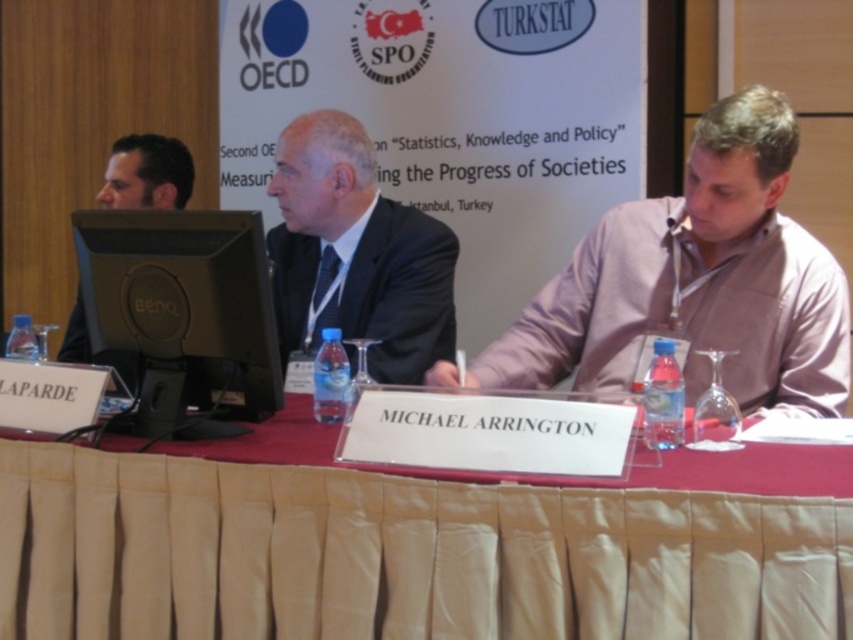
Question: Can you confirm if black glossy monitor at center is smaller than black suit at center?

Choices:
 (A) no
 (B) yes

Answer: (B)

Question: Does beige fabric tablecloth at center have a larger size compared to black suit at center?

Choices:
 (A) no
 (B) yes

Answer: (B)

Question: Among these points, which one is farthest from the camera?

Choices:
 (A) coord(839,376)
 (B) coord(216,248)
 (C) coord(97,195)

Answer: (C)

Question: Which object is positioned farthest from the black suit at center?

Choices:
 (A) pink cotton shirt at center
 (B) beige fabric tablecloth at center
 (C) matte black monitor at left

Answer: (C)

Question: Among these objects, which one is nearest to the camera?

Choices:
 (A) matte black monitor at left
 (B) black glossy monitor at center
 (C) pink cotton shirt at center
 (D) black suit at center

Answer: (B)

Question: Does pink cotton shirt at center have a larger size compared to black suit at center?

Choices:
 (A) no
 (B) yes

Answer: (B)